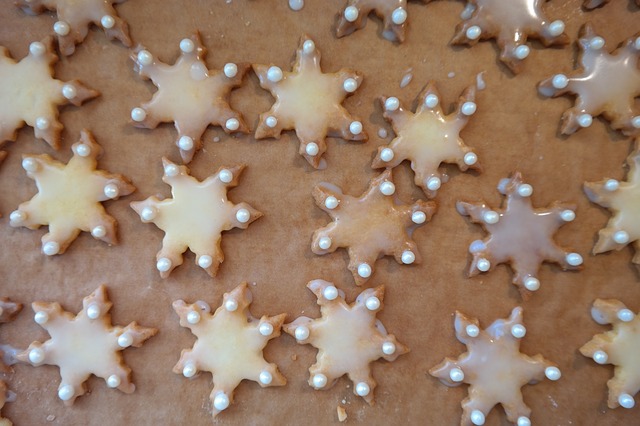
You are a GUI agent. You are given a task and a screenshot of the screen. Output one action in this format:
    pyautogui.click(x=<x>, y=<y>)
    Task: Click on the crumb
    The image size is (640, 426).
    Given the screenshot: What is the action you would take?
    (342, 414)